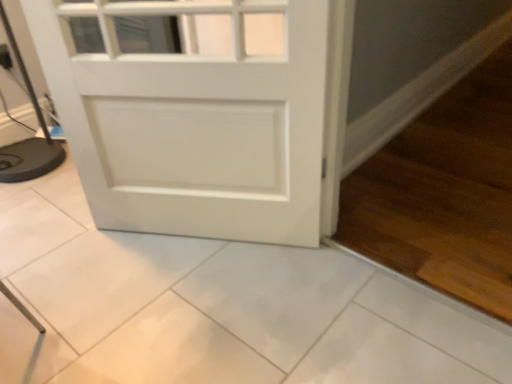
Identify the location of dark wood stairs at lower right. (444, 193).

The height and width of the screenshot is (384, 512). What do you see at coordinates (444, 193) in the screenshot? I see `dark wood stairs at lower right` at bounding box center [444, 193].

Image resolution: width=512 pixels, height=384 pixels. What are the coordinates of `dark wood stairs at lower right` in the screenshot? It's located at (444, 193).